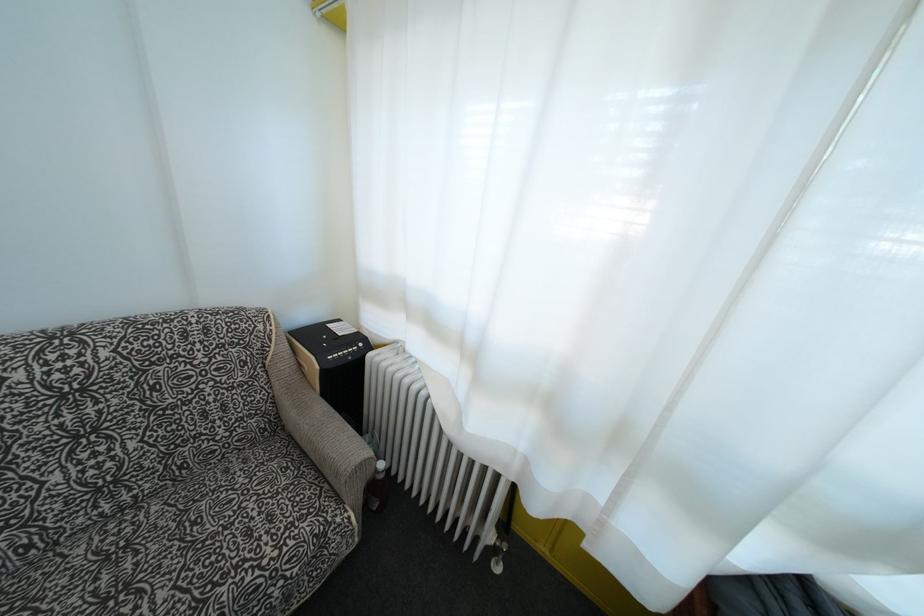
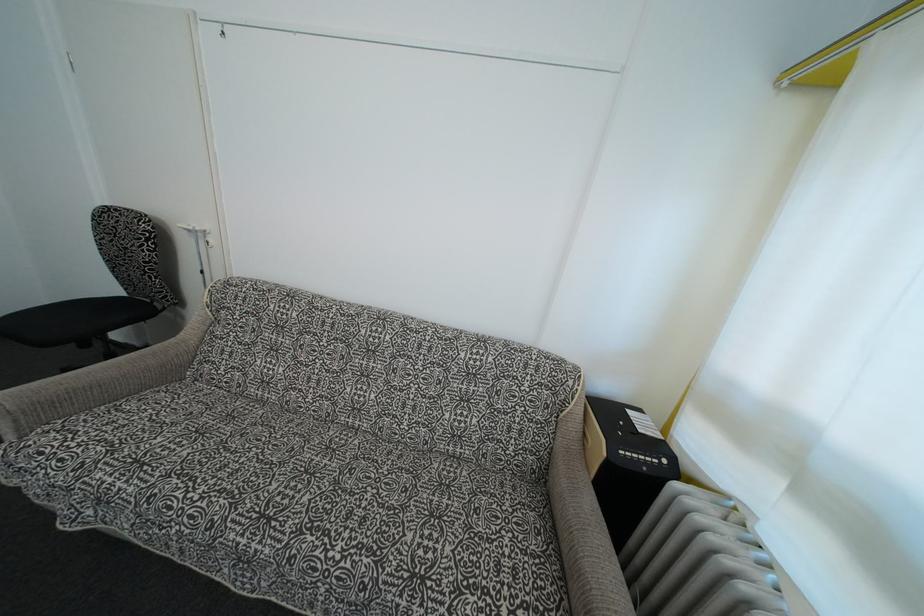
Question: Based on the continuous images, in which direction is the camera rotating? Reply with the corresponding letter.

Choices:
 (A) Left
 (B) Right
 (C) Up
 (D) Down

Answer: (A)